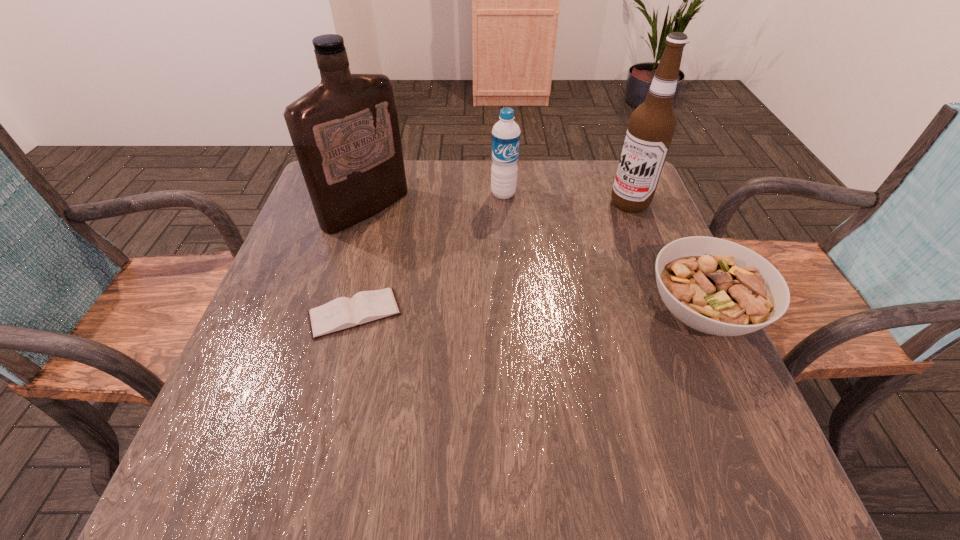
Image resolution: width=960 pixels, height=540 pixels. In order to click on vacant area that lies between the alcohol and the water bottle in this screenshot , I will do `click(566, 199)`.

The height and width of the screenshot is (540, 960). Identify the location of the closest object relative to the diary. (345, 131).

Select which object is the third closest to the shortest object. Please provide its 2D coordinates. Your answer should be formatted as a tuple, i.e. [(x, y)], where the tuple contains the x and y coordinates of a point satisfying the conditions above.

[(715, 286)]

Locate an element on the screen. vacant space that satisfies the following two spatial constraints: 1. on the back side of the liquor; 2. on the left side of the water bottle is located at coordinates (371, 194).

Where is `vacant space that satisfies the following two spatial constraints: 1. on the front side of the stew; 2. on the left side of the liquor`? The image size is (960, 540). vacant space that satisfies the following two spatial constraints: 1. on the front side of the stew; 2. on the left side of the liquor is located at coordinates (336, 312).

Identify the location of vacant region that satisfies the following two spatial constraints: 1. on the back side of the fourth tallest object; 2. on the left side of the diary. pos(355,312).

Image resolution: width=960 pixels, height=540 pixels. Identify the location of free space that satisfies the following two spatial constraints: 1. on the back side of the third shortest object; 2. on the right side of the liquor. (371, 194).